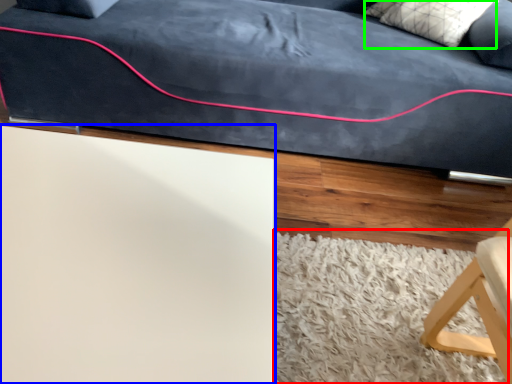
Question: Based on their relative distances, which object is nearer to mat (highlighted by a red box)? Choose from table (highlighted by a blue box) and pillow (highlighted by a green box).

Choices:
 (A) table
 (B) pillow

Answer: (A)